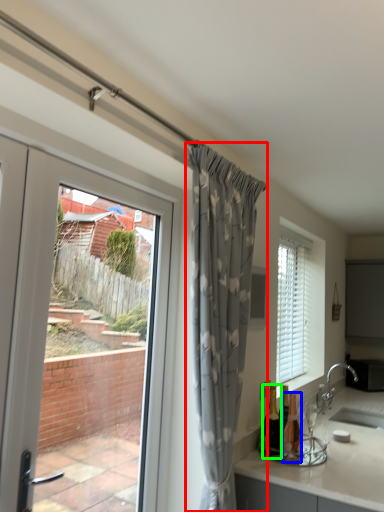
Question: Considering the real-world distances, which object is farthest from curtain (highlighted by a red box)? bottle (highlighted by a blue box) or bottle (highlighted by a green box)?

Choices:
 (A) bottle
 (B) bottle

Answer: (A)